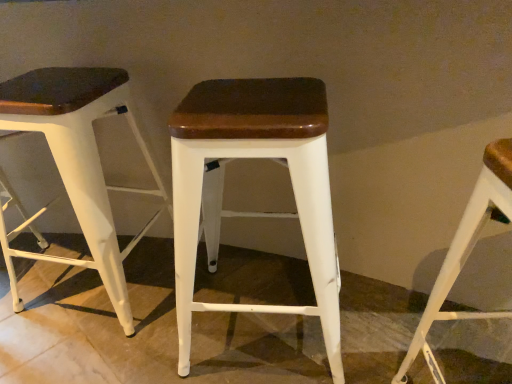
Question: Should I look upward or downward to see white matte wood stool at center, arranged as the second stool when viewed from the right?

Choices:
 (A) down
 (B) up

Answer: (A)

Question: From a real-world perspective, is white matte wood stool at center, arranged as the second stool when viewed from the right, on white matte stool at right, acting as the 1th stool starting from the right?

Choices:
 (A) yes
 (B) no

Answer: (B)

Question: Can you confirm if white matte wood stool at center, which appears as the 2th stool when viewed from the left, is thinner than white matte stool at right, which ranks as the 3th stool in left-to-right order?

Choices:
 (A) no
 (B) yes

Answer: (A)

Question: From the image's perspective, is white matte wood stool at center, arranged as the second stool when viewed from the right, located above white matte stool at right, which ranks as the 3th stool in left-to-right order?

Choices:
 (A) yes
 (B) no

Answer: (A)

Question: Does white matte wood stool at center, arranged as the second stool when viewed from the right, have a lesser height compared to white matte stool at right, which ranks as the 3th stool in left-to-right order?

Choices:
 (A) no
 (B) yes

Answer: (B)

Question: Can you confirm if white matte wood stool at center, which appears as the 2th stool when viewed from the left, is taller than white matte stool at right, acting as the 1th stool starting from the right?

Choices:
 (A) yes
 (B) no

Answer: (B)

Question: Is white matte wood stool at center, which appears as the 2th stool when viewed from the left, facing away from white matte stool at right, which ranks as the 3th stool in left-to-right order?

Choices:
 (A) no
 (B) yes

Answer: (A)

Question: Can you confirm if white matte stool at right, which ranks as the 3th stool in left-to-right order, is wider than white matte wood stool at center, the 3th stool viewed from the right?

Choices:
 (A) no
 (B) yes

Answer: (A)

Question: Is white matte wood stool at center, the 3th stool viewed from the right, at the back of white matte stool at right, acting as the 1th stool starting from the right?

Choices:
 (A) no
 (B) yes

Answer: (A)

Question: Is white matte stool at right, which ranks as the 3th stool in left-to-right order, at the left side of white matte wood stool at center, the 3th stool viewed from the right?

Choices:
 (A) yes
 (B) no

Answer: (B)

Question: From the image's perspective, does white matte stool at right, which ranks as the 3th stool in left-to-right order, appear higher than white matte wood stool at center, which is the first stool from left to right?

Choices:
 (A) no
 (B) yes

Answer: (A)

Question: Is white matte stool at right, which ranks as the 3th stool in left-to-right order, bigger than white matte wood stool at center, the 3th stool viewed from the right?

Choices:
 (A) no
 (B) yes

Answer: (A)

Question: From a real-world perspective, is white matte stool at right, acting as the 1th stool starting from the right, located higher than white matte wood stool at center, the 3th stool viewed from the right?

Choices:
 (A) yes
 (B) no

Answer: (A)

Question: Is white matte wood stool at center, which appears as the 2th stool when viewed from the left, not close to white matte wood stool at center, which is the first stool from left to right?

Choices:
 (A) no
 (B) yes

Answer: (A)